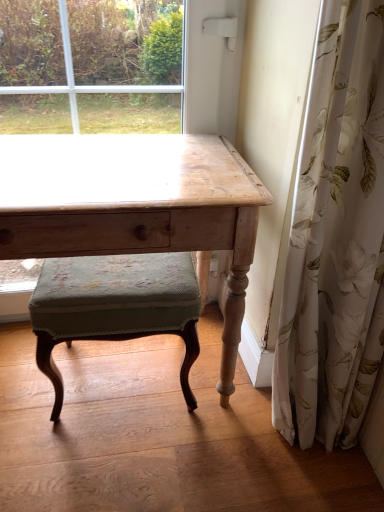
Question: Is white floral fabric at right taller than velvet green cushioned stool at center?

Choices:
 (A) yes
 (B) no

Answer: (A)

Question: Is white floral fabric at right closer to camera compared to velvet green cushioned stool at center?

Choices:
 (A) no
 (B) yes

Answer: (B)

Question: Is white floral fabric at right wider than velvet green cushioned stool at center?

Choices:
 (A) no
 (B) yes

Answer: (A)

Question: Is white floral fabric at right shorter than velvet green cushioned stool at center?

Choices:
 (A) yes
 (B) no

Answer: (B)

Question: Is white floral fabric at right positioned with its back to velvet green cushioned stool at center?

Choices:
 (A) no
 (B) yes

Answer: (A)

Question: From the image's perspective, is white floral fabric at right on velvet green cushioned stool at center?

Choices:
 (A) yes
 (B) no

Answer: (A)

Question: Is velvet green cushioned stool at center with wooden desk at center?

Choices:
 (A) no
 (B) yes

Answer: (A)

Question: Would you say wooden desk at center is part of velvet green cushioned stool at center's contents?

Choices:
 (A) yes
 (B) no

Answer: (B)

Question: Can you confirm if velvet green cushioned stool at center is positioned to the right of wooden desk at center?

Choices:
 (A) no
 (B) yes

Answer: (B)

Question: Would you consider velvet green cushioned stool at center to be distant from wooden desk at center?

Choices:
 (A) no
 (B) yes

Answer: (A)

Question: Considering the relative sizes of velvet green cushioned stool at center and wooden desk at center in the image provided, is velvet green cushioned stool at center smaller than wooden desk at center?

Choices:
 (A) yes
 (B) no

Answer: (A)

Question: Is velvet green cushioned stool at center closer to the viewer compared to wooden desk at center?

Choices:
 (A) yes
 (B) no

Answer: (B)

Question: Is wooden table at center positioned with its back to white floral fabric at right?

Choices:
 (A) no
 (B) yes

Answer: (A)